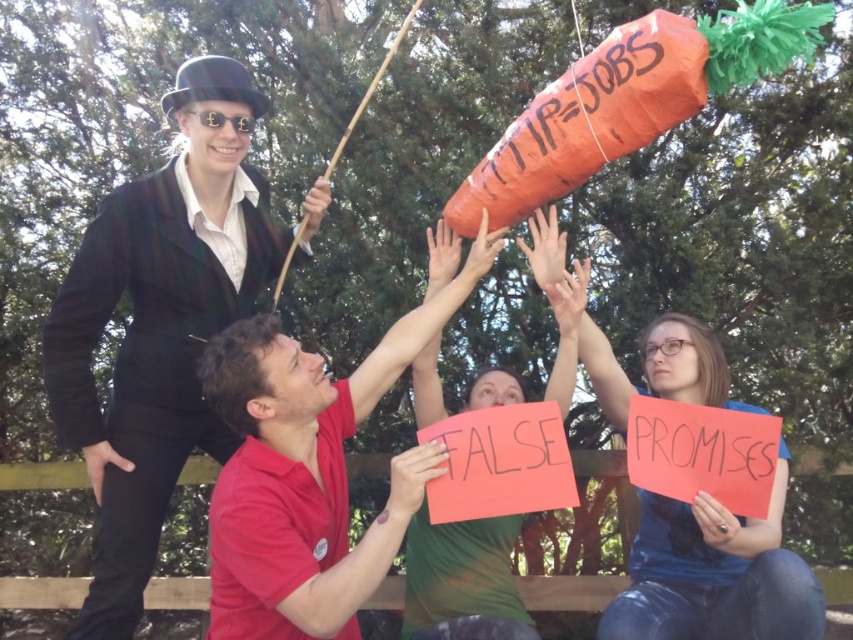
In the scene shown: Is red cotton shirt at center smaller than green fabric shirt at center?

Incorrect, red cotton shirt at center is not smaller in size than green fabric shirt at center.

Who is taller, red cotton shirt at center or green fabric shirt at center?

red cotton shirt at center

What do you see at coordinates (309, 472) in the screenshot? I see `red cotton shirt at center` at bounding box center [309, 472].

Locate an element on the screen. This screenshot has width=853, height=640. red cotton shirt at center is located at coordinates (309, 472).

Which of these two, matte black suit at upper left or green fabric shirt at center, stands taller?

Standing taller between the two is matte black suit at upper left.

Is point (178, 93) more distant than point (509, 531)?

No, it is in front of (509, 531).

Identify the location of matte black suit at upper left. (160, 324).

Can you confirm if red cotton shirt at center is positioned to the left of blue denim jeans at lower right?

Yes, red cotton shirt at center is to the left of blue denim jeans at lower right.

Who is positioned more to the left, red cotton shirt at center or blue denim jeans at lower right?

red cotton shirt at center is more to the left.

Where is `red cotton shirt at center`? red cotton shirt at center is located at coordinates (309, 472).